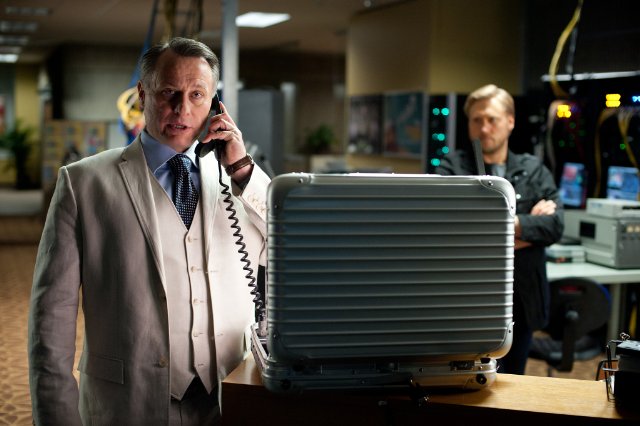
This screenshot has width=640, height=426. Find the location of `floor`. floor is located at coordinates (12, 274).